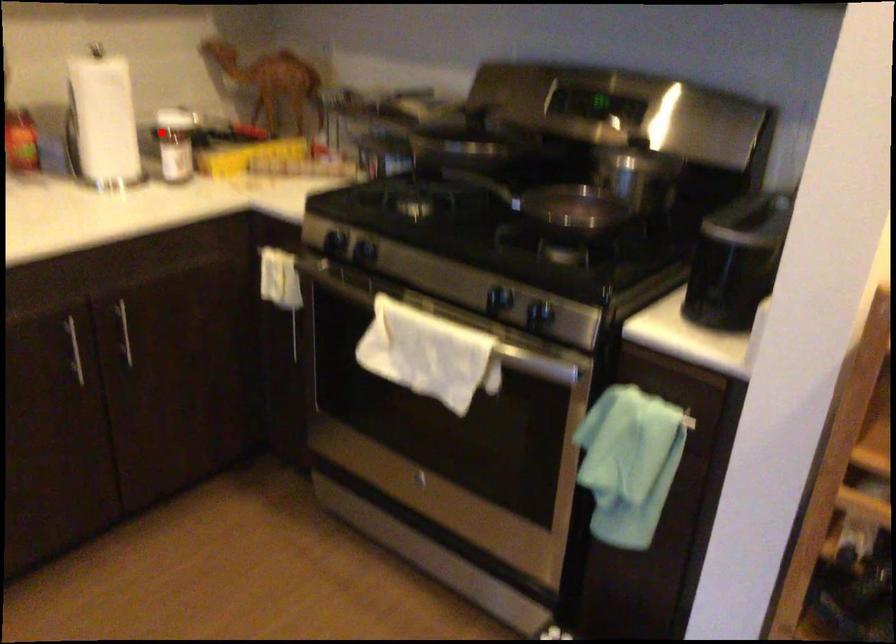
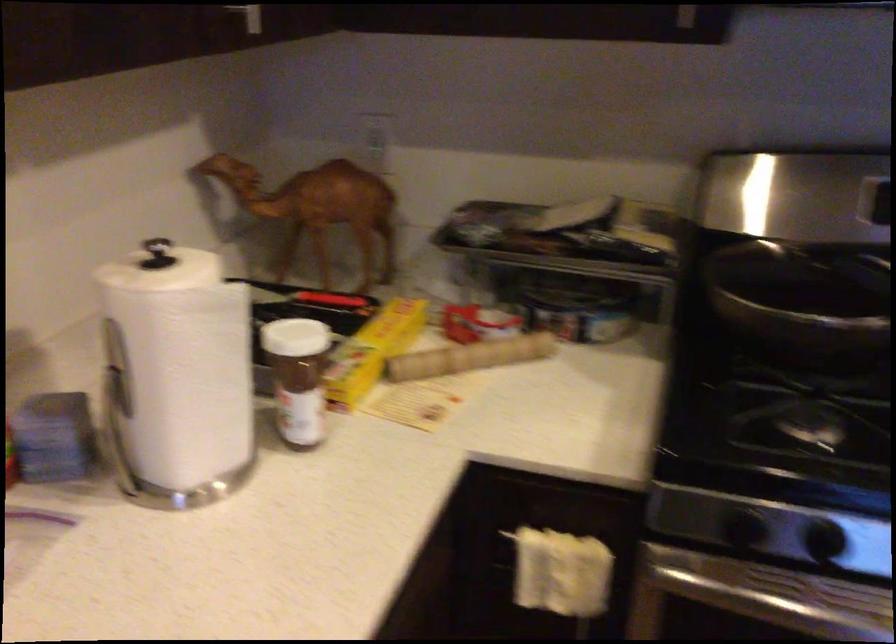
Question: I am providing you with two images of the same scene from different viewpoints. In image1, a red point is highlighted. Considering the same 3D point in image2, which of the following is correct?

Choices:
 (A) It is closer
 (B) It is farther

Answer: (A)